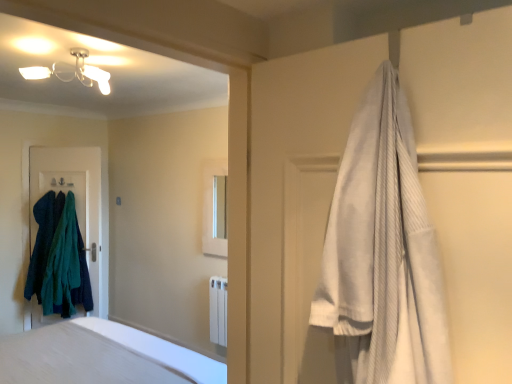
Question: Considering the relative positions of teal fuzzy sweater at left, arranged as the first clothing when viewed from the right, and white glossy medicine cabinet at center in the image provided, is teal fuzzy sweater at left, arranged as the first clothing when viewed from the right, to the left or to the right of white glossy medicine cabinet at center?

Choices:
 (A) right
 (B) left

Answer: (B)

Question: Is teal fuzzy sweater at left, the second clothing from the left, wider or thinner than white glossy medicine cabinet at center?

Choices:
 (A) wide
 (B) thin

Answer: (A)

Question: Considering the real-world distances, which object is farthest from the white soft bed at center?

Choices:
 (A) teal fuzzy sweater at left, the second clothing from the left
 (B) white glossy medicine cabinet at center
 (C) white smooth bathtub at lower left
 (D) dark blue fabric at left
 (E) white cotton robe at upper right

Answer: (E)

Question: Based on their relative distances, which object is farther from the teal fuzzy sweater at left, the second clothing from the left?

Choices:
 (A) dark blue fabric at left
 (B) white soft bed at center
 (C) dark green fuzzy sweater at left, which is counted as the first clothing, starting from the left
 (D) white smooth bathtub at lower left
 (E) white glossy medicine cabinet at center

Answer: (D)